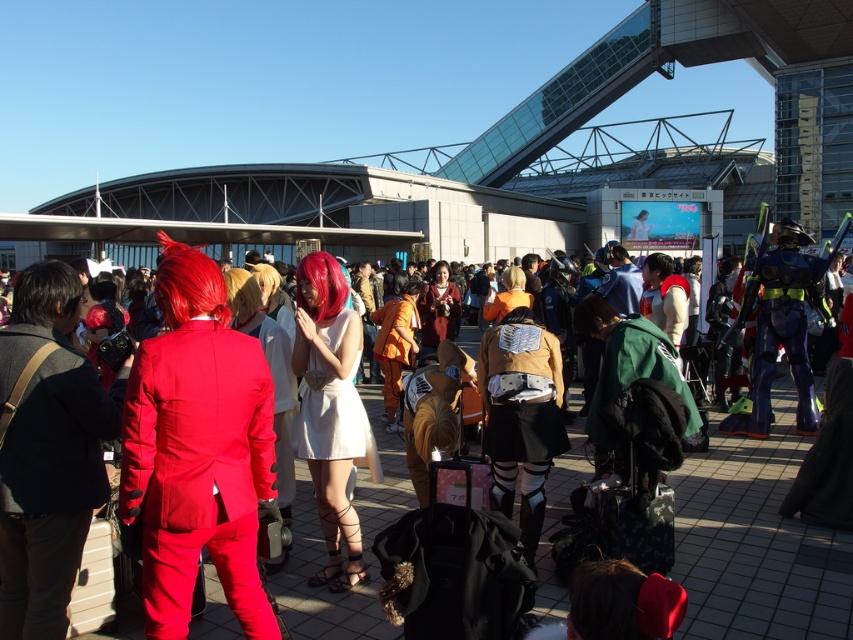
Is white satin dress at center positioned before matte brown coat at center?

Yes, white satin dress at center is in front of matte brown coat at center.

You are a GUI agent. You are given a task and a screenshot of the screen. Output one action in this format:
    pyautogui.click(x=<x>, y=<y>)
    Task: Click on the white satin dress at center
    
    Given the screenshot: What is the action you would take?
    pyautogui.click(x=329, y=412)

Is point (300, 275) positioned in front of point (372, 349)?

That is True.

Can you confirm if white satin dress at center is thinner than orange fabric pants at center?

Correct, white satin dress at center's width is less than orange fabric pants at center's.

Between point (328, 364) and point (389, 314), which one is positioned behind?

Point (389, 314)

This screenshot has height=640, width=853. Identify the location of white satin dress at center. (329, 412).

Does orange fabric pants at center come in front of matte brown coat at center?

That is True.

Which is in front, point (399, 346) or point (421, 321)?

Point (399, 346) is in front.

The width and height of the screenshot is (853, 640). I want to click on orange fabric pants at center, so click(395, 344).